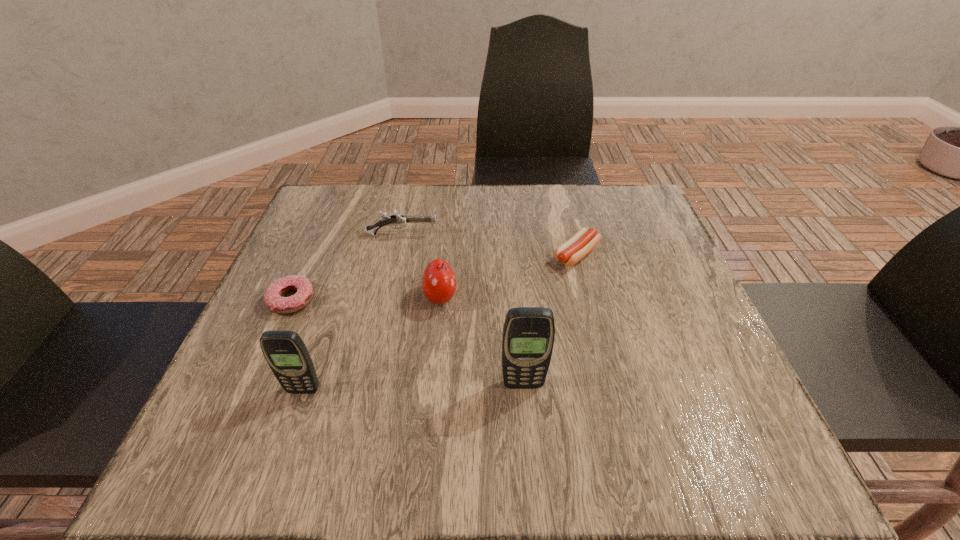
At what (x,y) coordinates should I click in order to perform the action: click on vacant space at the far edge of the desktop. Please return your answer as a coordinate pair (x, y). Image resolution: width=960 pixels, height=540 pixels. Looking at the image, I should click on (x=413, y=194).

The width and height of the screenshot is (960, 540). I want to click on free space at the near edge, so click(468, 413).

Identify the location of vacant area at the right edge of the desktop. Image resolution: width=960 pixels, height=540 pixels. (638, 314).

In the image, there is a desktop. What are the coordinates of `vacant space at the far left corner` in the screenshot? It's located at (315, 238).

In the image, there is a desktop. Find the location of `vacant area at the far right corner`. vacant area at the far right corner is located at coordinates (643, 237).

Locate an element on the screen. free spot at the near right corner of the desktop is located at coordinates (732, 393).

The height and width of the screenshot is (540, 960). I want to click on free spot between the leftmost object and the tallest object, so click(407, 342).

Identify the location of vacant space that's between the gun and the rightmost object. (489, 245).

Where is `free space that is in between the rightmost object and the left cellular telephone`? free space that is in between the rightmost object and the left cellular telephone is located at coordinates (440, 322).

At what (x,y) coordinates should I click in order to perform the action: click on vacant area between the sausage and the shorter cellular telephone. Please return your answer as a coordinate pair (x, y). This screenshot has width=960, height=540. Looking at the image, I should click on (440, 322).